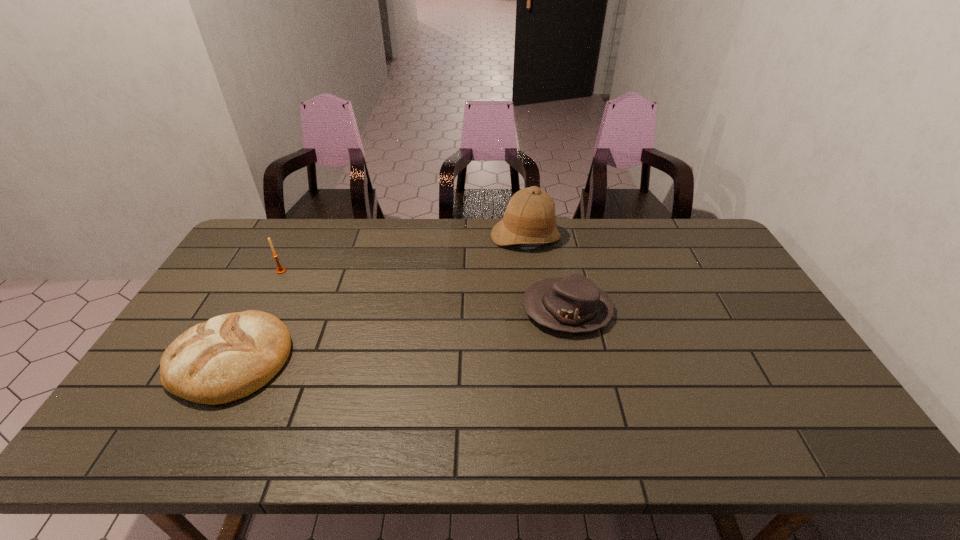
At what (x,y) coordinates should I click in order to perform the action: click on the farther hat. Please return your answer as a coordinate pair (x, y). Image resolution: width=960 pixels, height=540 pixels. Looking at the image, I should click on (529, 218).

Locate an element on the screen. the tallest object is located at coordinates (529, 218).

The image size is (960, 540). I want to click on the third nearest object, so click(280, 270).

The width and height of the screenshot is (960, 540). I want to click on candle_holder, so click(280, 270).

Where is `the shorter hat`? The image size is (960, 540). the shorter hat is located at coordinates (574, 304).

Locate an element on the screen. Image resolution: width=960 pixels, height=540 pixels. bread is located at coordinates (230, 356).

Identify the location of vacant space located on the front-facing side of the taller hat. Image resolution: width=960 pixels, height=540 pixels. (539, 331).

The width and height of the screenshot is (960, 540). Find the location of `vacant region located on the right of the third shortest object`. vacant region located on the right of the third shortest object is located at coordinates (372, 271).

Identify the location of vacant area situated 0.380m on the decorative side of the nearer hat. (395, 310).

Where is `free region located 0.260m on the decorative side of the nearer hat`? The image size is (960, 540). free region located 0.260m on the decorative side of the nearer hat is located at coordinates click(435, 310).